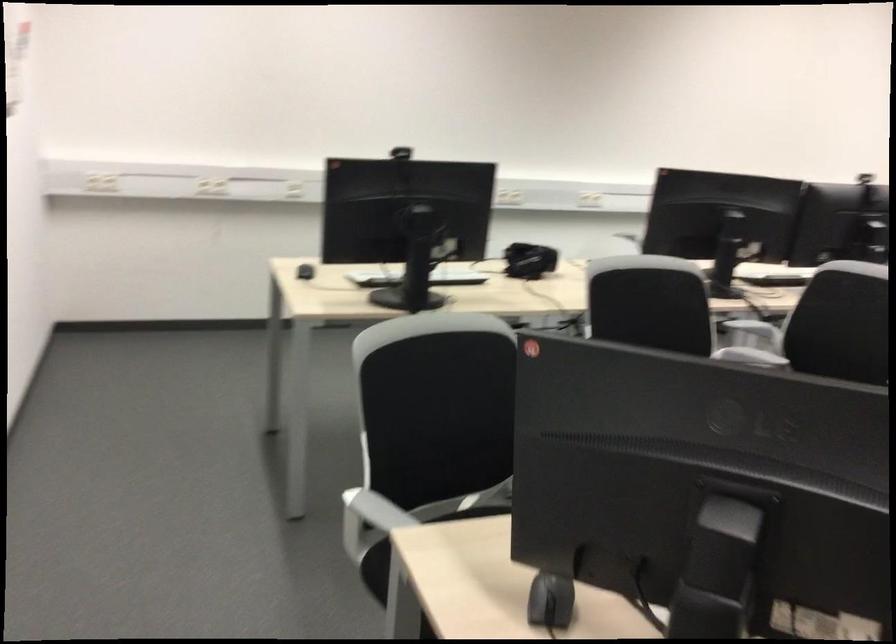
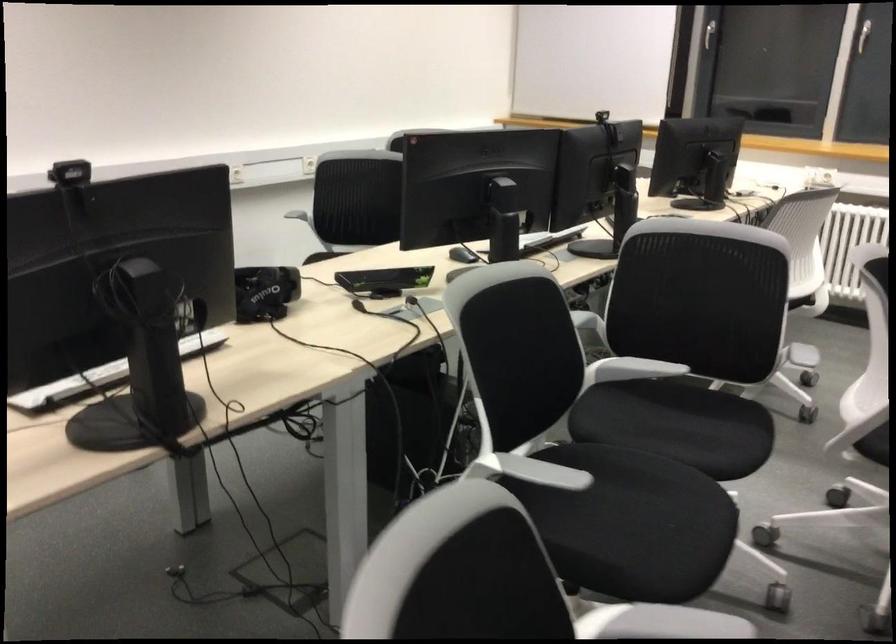
Locate, in the second image, the point that corresponds to (746,354) in the first image.

(631, 368)